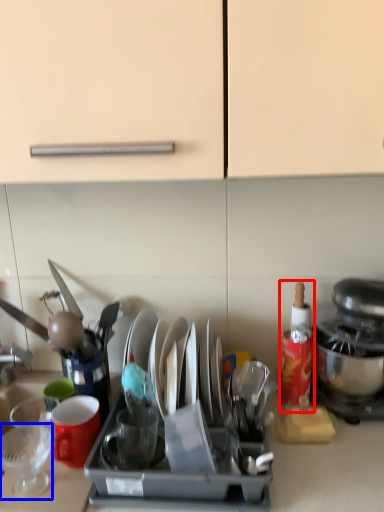
Question: Which object appears farthest to the camera in this image, bottle (highlighted by a red box) or tableware (highlighted by a blue box)?

Choices:
 (A) bottle
 (B) tableware

Answer: (A)